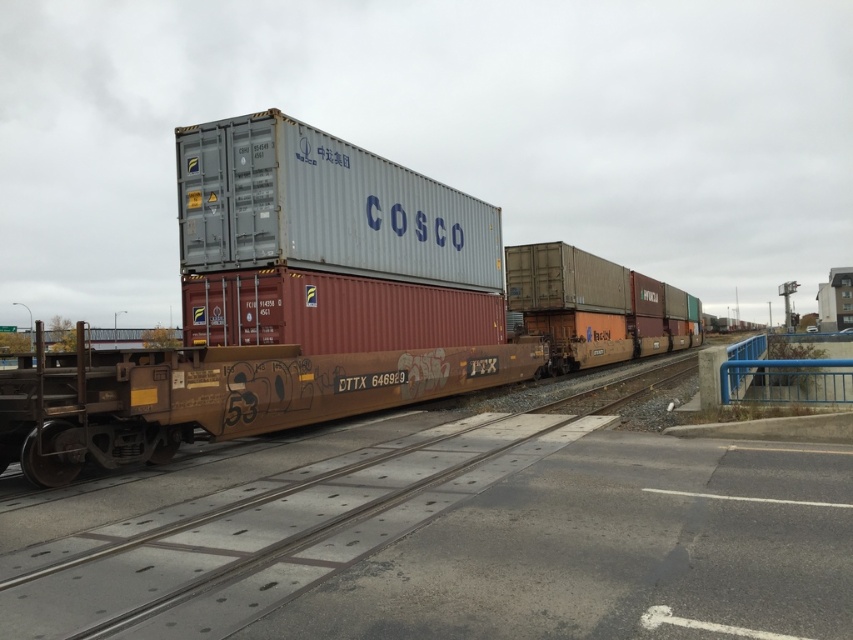
Is point (350, 163) less distant than point (144, 582)?

No, (350, 163) is behind (144, 582).

Is point (500, 275) positioned after point (317, 570)?

That is True.

Where is `metallic gray container at center`? This screenshot has width=853, height=640. metallic gray container at center is located at coordinates (x=306, y=307).